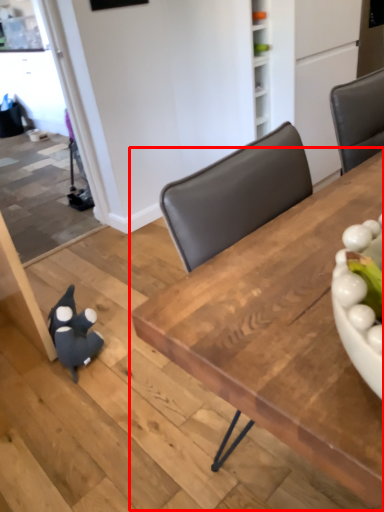
Question: From the image, what is the correct spatial relationship of table (annotated by the red box) in relation to toy?

Choices:
 (A) left
 (B) right

Answer: (B)